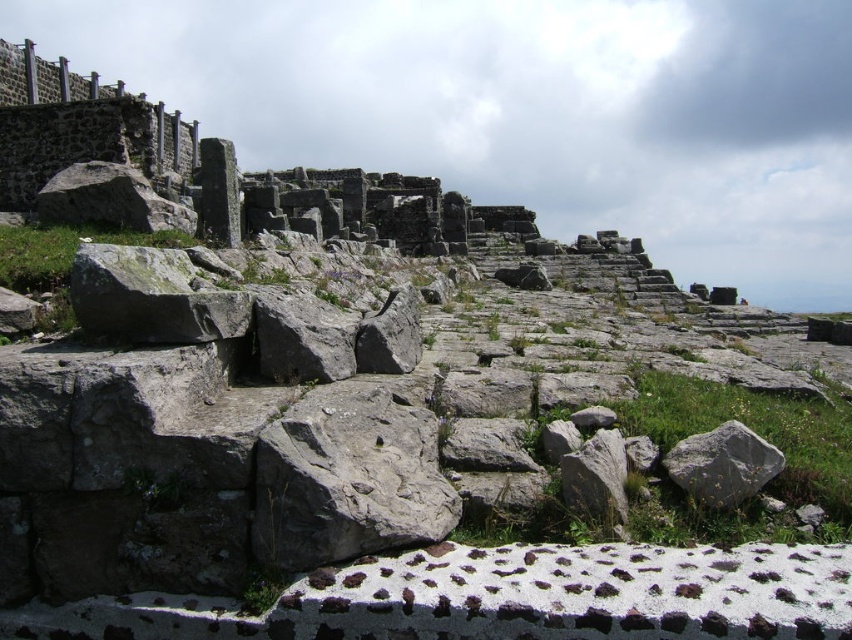
Is gray rough stone at center closer to camera compared to gray rough rock at center?

Yes, gray rough stone at center is closer to the viewer.

Between gray rough stone at center and gray rough rock at center, which one appears on the left side from the viewer's perspective?

gray rough stone at center

Identify the location of gray rough stone at center. (348, 477).